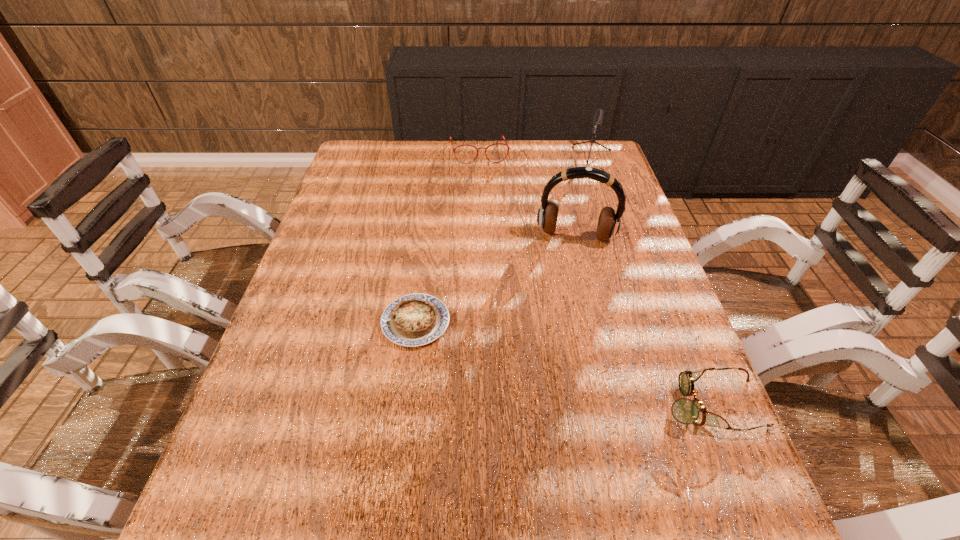
This screenshot has height=540, width=960. What are the coordinates of `spectacles present at the far edge` in the screenshot? It's located at (506, 144).

Find the location of a particular element. The image size is (960, 540). object that is positioned at the near edge is located at coordinates (685, 411).

At what (x,y) coordinates should I click in order to perform the action: click on spectacles situated at the right edge. Please return your answer as a coordinate pair (x, y). Looking at the image, I should click on (685, 411).

This screenshot has width=960, height=540. I want to click on headset present at the right edge, so click(x=609, y=222).

What are the coordinates of `microphone present at the right edge` in the screenshot? It's located at (596, 121).

Where is `object that is at the far right corner`? This screenshot has width=960, height=540. object that is at the far right corner is located at coordinates (596, 121).

The height and width of the screenshot is (540, 960). I want to click on object located in the near right corner section of the desktop, so click(x=685, y=411).

At what (x,y) coordinates should I click in order to perform the action: click on vacant space at the far edge of the desktop. Please return your answer as a coordinate pair (x, y). The height and width of the screenshot is (540, 960). Looking at the image, I should click on (432, 143).

The width and height of the screenshot is (960, 540). In the image, there is a desktop. What are the coordinates of `blank space at the near edge` in the screenshot? It's located at (526, 470).

At what (x,y) coordinates should I click in order to perform the action: click on vacant space at the left edge of the desktop. Please return your answer as a coordinate pair (x, y). Looking at the image, I should click on (350, 251).